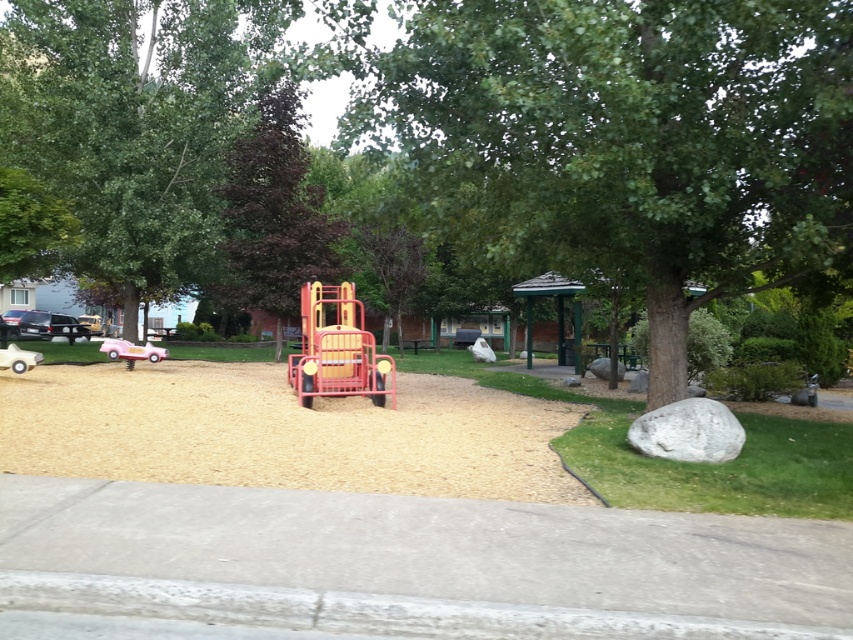
Question: Which object is positioned farthest from the brown gravel at center?

Choices:
 (A) white rubber car at lower left
 (B) metallic red play truck at center
 (C) pink plastic car at left
 (D) green leafy tree at center

Answer: (A)

Question: Does dark green leafy tree at center have a smaller size compared to white rubber car at lower left?

Choices:
 (A) no
 (B) yes

Answer: (A)

Question: From the image, what is the correct spatial relationship of dark green leafy tree at center in relation to pink plastic car at left?

Choices:
 (A) left
 (B) right

Answer: (B)

Question: Can you confirm if green leafy tree at center is positioned to the right of dark green leafy tree at center?

Choices:
 (A) no
 (B) yes

Answer: (B)

Question: Which of the following is the farthest from the observer?

Choices:
 (A) (21, 369)
 (B) (323, 394)
 (C) (143, 346)
 (D) (294, 173)

Answer: (D)

Question: Which point is farther to the camera?

Choices:
 (A) (225, 237)
 (B) (22, 355)

Answer: (A)